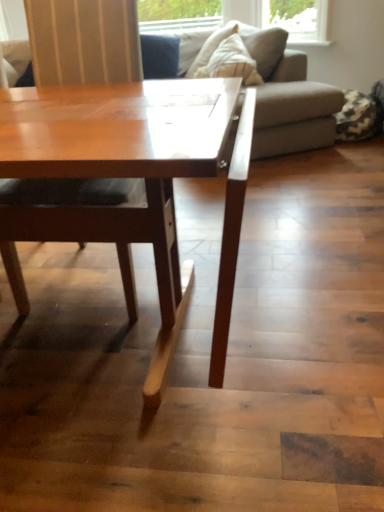
Where is `vacant space in matte wood chair at center (from a real-world perspective)`? This screenshot has width=384, height=512. vacant space in matte wood chair at center (from a real-world perspective) is located at coordinates (92, 279).